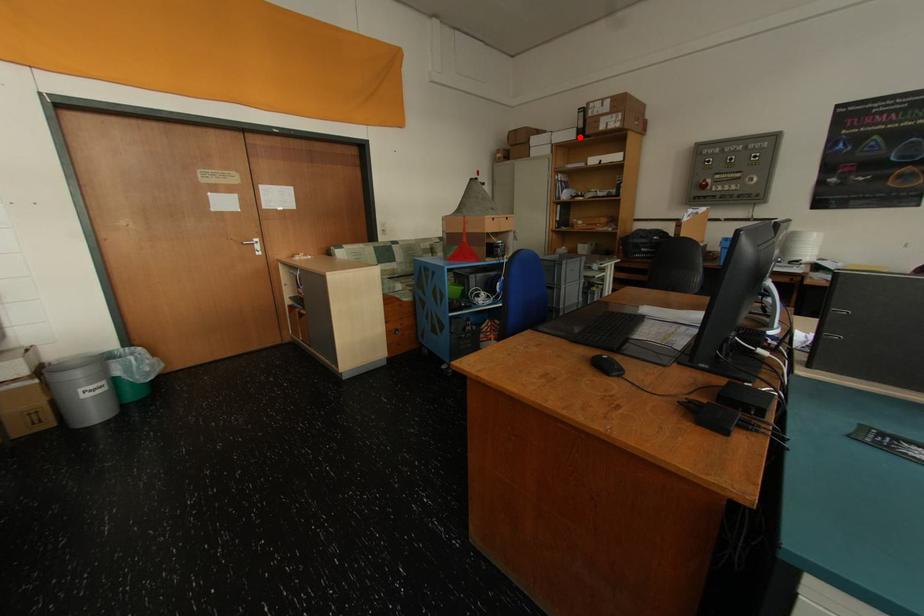
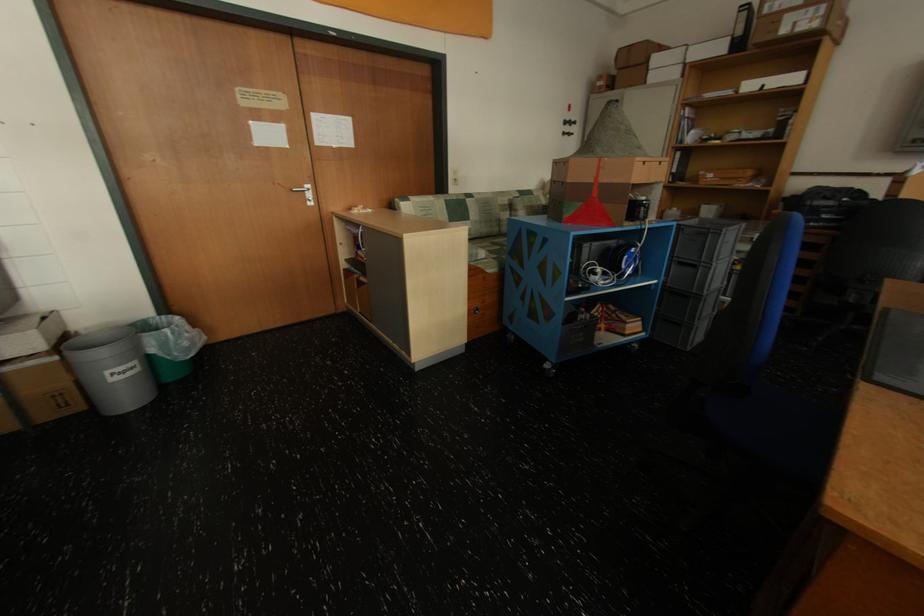
Question: I am providing you with two images of the same scene from different viewpoints. A red point is shown in image1. For the corresponding object point in image2, is it positioned nearer or farther from the camera?

Choices:
 (A) Nearer
 (B) Farther

Answer: (B)